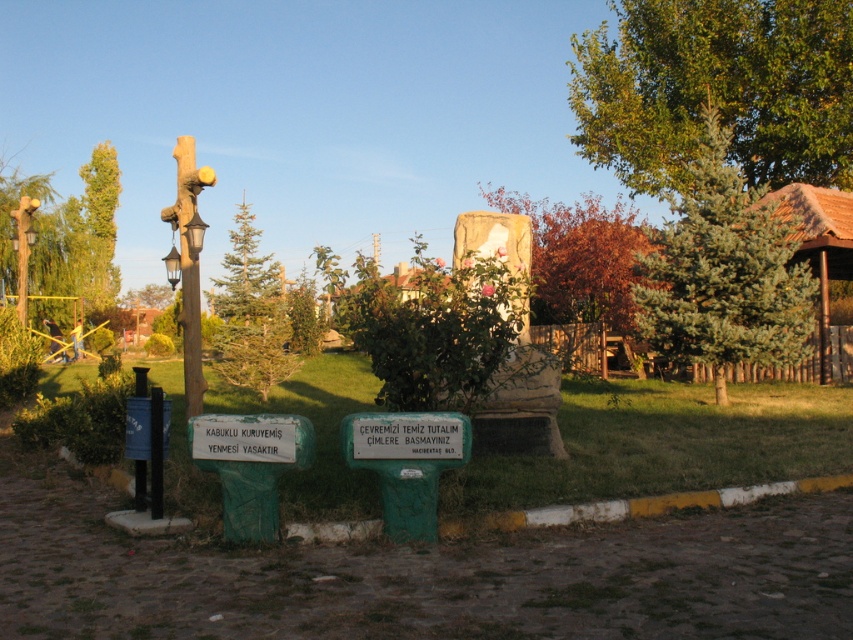
Question: Which of the following is the closest to the observer?

Choices:
 (A) (718, 128)
 (B) (352, 436)
 (C) (816, 102)

Answer: (B)

Question: Based on their relative distances, which object is nearer to the green leafy tree at left?

Choices:
 (A) green fir tree at upper right
 (B) white plastic sign at center
 (C) brushed metal pole at left
 (D) green stone sign at center

Answer: (A)

Question: Does white plastic sign at center appear on the right side of brushed metal pole at left?

Choices:
 (A) yes
 (B) no

Answer: (A)

Question: Which object appears closest to the camera in this image?

Choices:
 (A) green leafy tree at upper right
 (B) green leafy tree at upper left
 (C) green stone sign at center
 (D) brushed metal pole at left

Answer: (C)

Question: Does white plastic sign at center lie behind green stone sign at center?

Choices:
 (A) yes
 (B) no

Answer: (A)

Question: Is green leafy tree at upper right smaller than green fir tree at upper right?

Choices:
 (A) no
 (B) yes

Answer: (A)